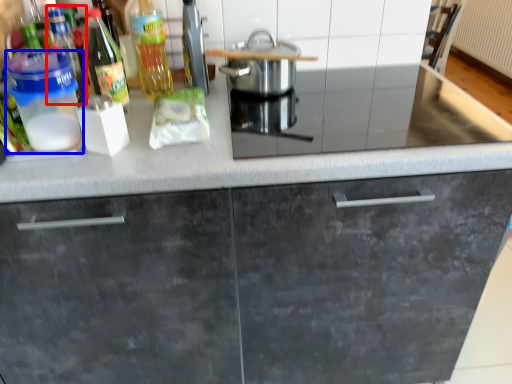
Question: Which point is closer to the camera, bottle (highlighted by a red box) or kitchen appliance (highlighted by a blue box)?

Choices:
 (A) bottle
 (B) kitchen appliance

Answer: (B)